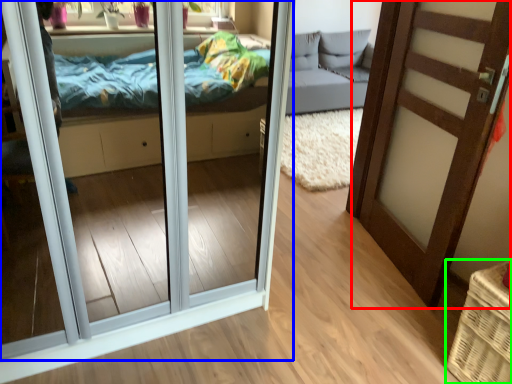
Question: Which is farther away from door (highlighted by a red box)? door (highlighted by a blue box) or basket (highlighted by a green box)?

Choices:
 (A) door
 (B) basket

Answer: (A)